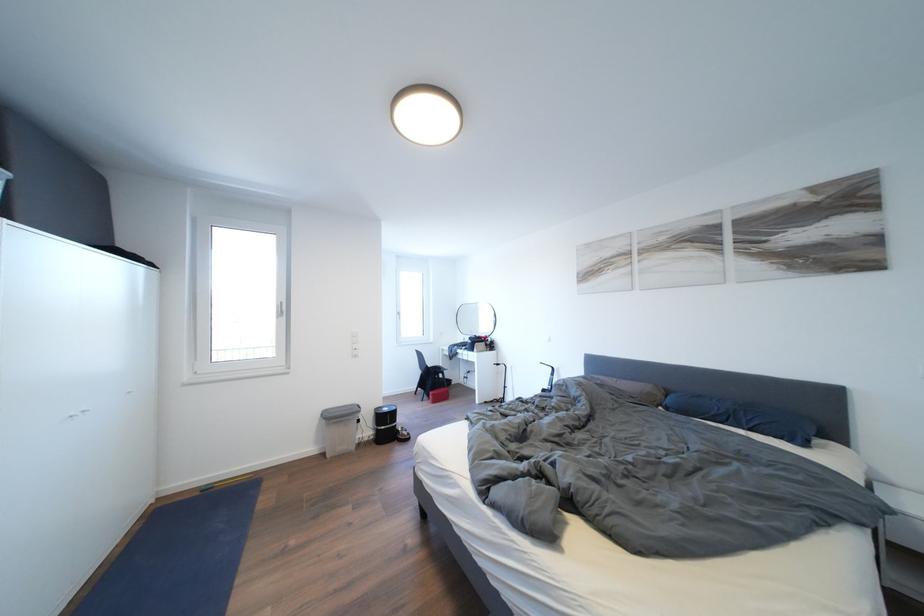
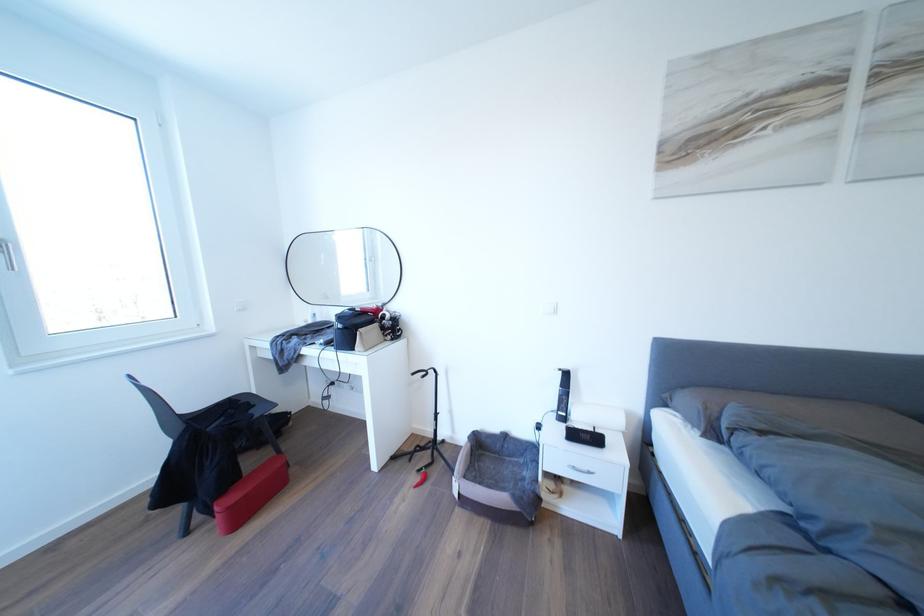
Find the pixel in the second image that matches point 468,344 in the first image.

(310, 322)